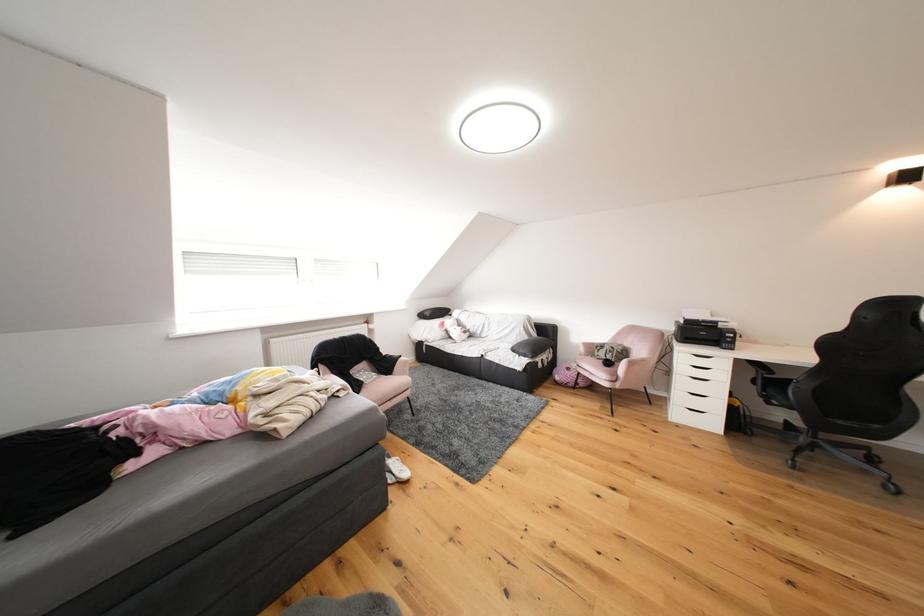
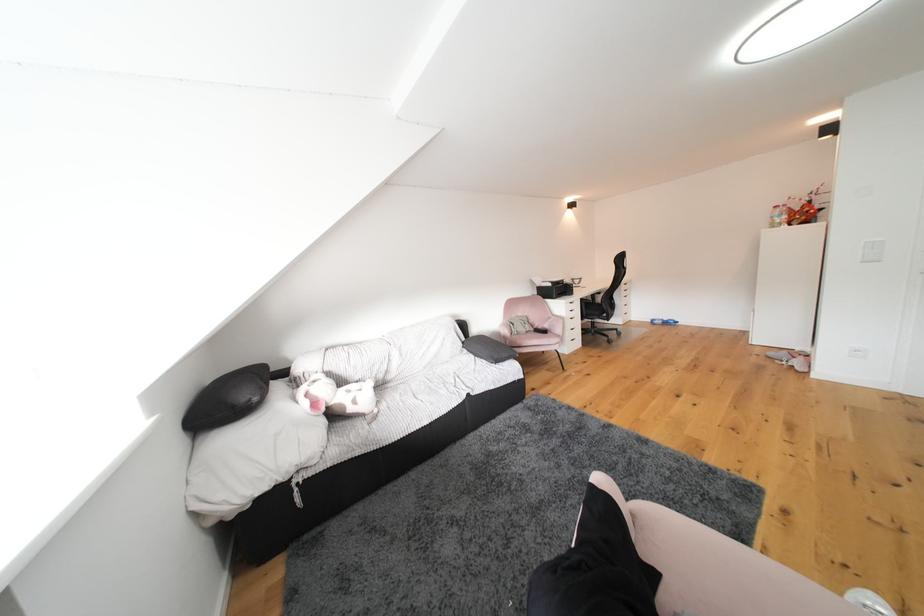
The point at [724,326] is marked in the first image. Where is the corresponding point in the second image?

(572, 285)